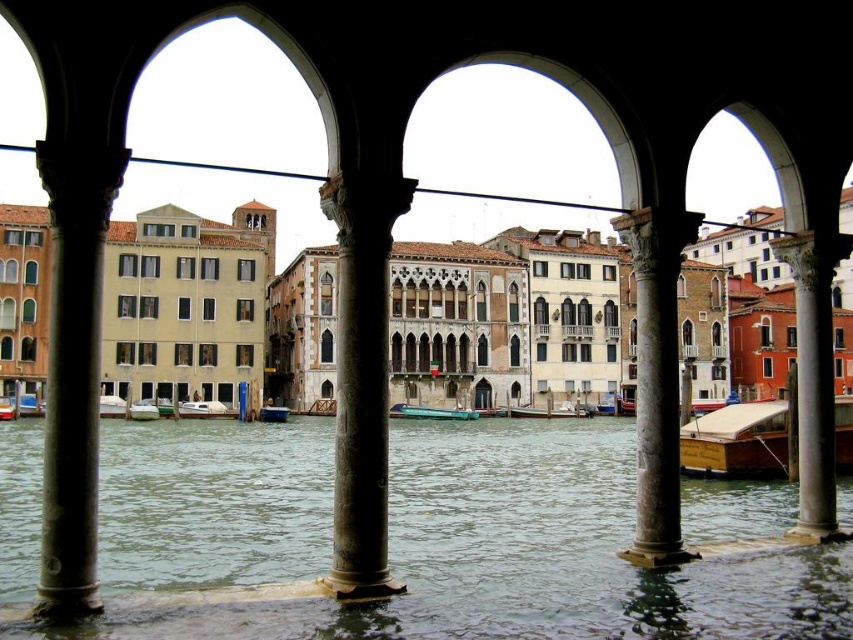
You are standing under the arches looking at the canal. You notice two wooden polished boats. Which boat, the wooden polished boat at right or the wooden polished boat at center, is taller?

The wooden polished boat at right is taller than the wooden polished boat at center.

You are a tourist in Venice and want to take a photo of the clear water at center and the white wooden boat at center through the arches. Which object will occupy more space in your photo?

The clear water at center is bigger than the white wooden boat at center, so it will occupy more space in the photo.